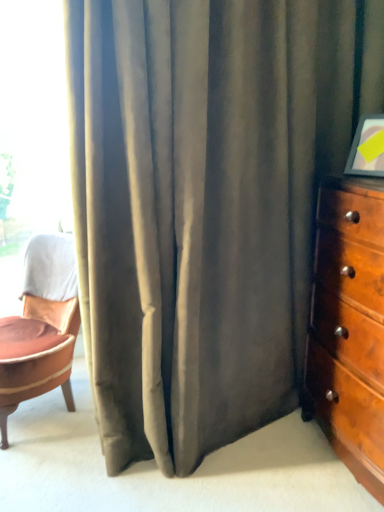
Question: Can you confirm if wooden dresser at right is thinner than transparent glass window at upper left?

Choices:
 (A) no
 (B) yes

Answer: (A)

Question: Can transparent glass window at upper left be found inside wooden dresser at right?

Choices:
 (A) no
 (B) yes

Answer: (A)

Question: Is the depth of wooden dresser at right less than that of transparent glass window at upper left?

Choices:
 (A) no
 (B) yes

Answer: (B)

Question: Is wooden dresser at right far from transparent glass window at upper left?

Choices:
 (A) yes
 (B) no

Answer: (A)

Question: Can you confirm if wooden dresser at right is positioned to the left of transparent glass window at upper left?

Choices:
 (A) yes
 (B) no

Answer: (B)

Question: Is wooden dresser at right bigger than transparent glass window at upper left?

Choices:
 (A) yes
 (B) no

Answer: (A)

Question: Considering the relative sizes of transparent glass window at upper left and leather cushioned chair at left in the image provided, is transparent glass window at upper left bigger than leather cushioned chair at left?

Choices:
 (A) yes
 (B) no

Answer: (B)

Question: From a real-world perspective, is transparent glass window at upper left under leather cushioned chair at left?

Choices:
 (A) yes
 (B) no

Answer: (B)

Question: Does transparent glass window at upper left lie in front of leather cushioned chair at left?

Choices:
 (A) no
 (B) yes

Answer: (A)

Question: Is transparent glass window at upper left outside of leather cushioned chair at left?

Choices:
 (A) no
 (B) yes

Answer: (B)

Question: Can you confirm if transparent glass window at upper left is smaller than leather cushioned chair at left?

Choices:
 (A) no
 (B) yes

Answer: (B)

Question: From the image's perspective, would you say transparent glass window at upper left is shown under leather cushioned chair at left?

Choices:
 (A) no
 (B) yes

Answer: (A)

Question: Is leather cushioned chair at left wider than wooden dresser at right?

Choices:
 (A) yes
 (B) no

Answer: (A)